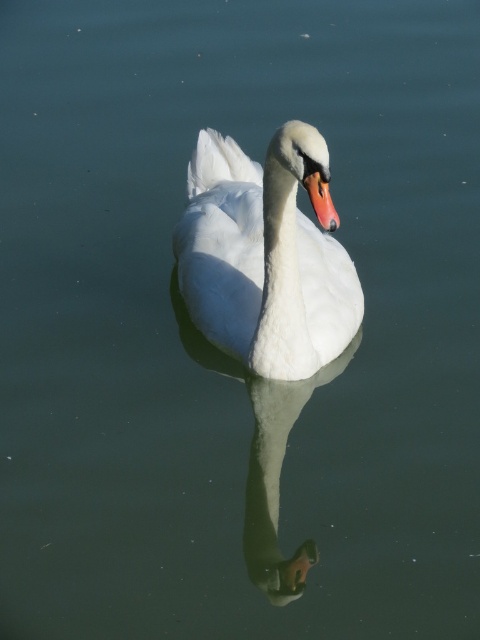
Where is the white glossy swan at center located in the image?

The white glossy swan at center is located at point [264,257].

You are a photographer trying to capture the reflection of the white glossy swan at center and the matte orange beak at center in the water. Which object will you focus on first to ensure the reflection is clear?

The white glossy swan at center is located above the matte orange beak at center. Since reflections are typically of the object above the water, focusing on the white glossy swan at center first will ensure its reflection is clear in the water below.

You are a photographer trying to capture the swan in the image. You need to ensure that the white glossy swan at center is fully visible in your shot. Given that your camera frame can only accommodate objects up to the size of the matte orange beak at center, will you need to adjust your framing?

The white glossy swan at center is wider than the matte orange beak at center, so the camera frame cannot fully capture the swan without adjustment. You will need to widen your framing to include the entire swan.